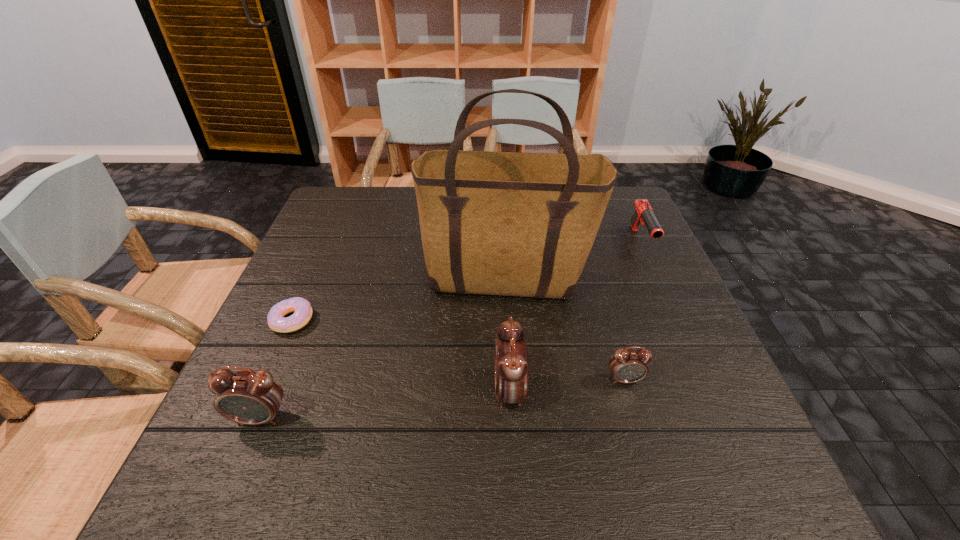
You are a GUI agent. You are given a task and a screenshot of the screen. Output one action in this format:
    pyautogui.click(x=<x>, y=<y>)
    Task: Click on the alarm clock that is the closest to the tallest object
    This screenshot has width=960, height=540.
    Given the screenshot: What is the action you would take?
    pyautogui.click(x=511, y=356)

The width and height of the screenshot is (960, 540). Find the location of `free space that satisfies the following two spatial constraints: 1. on the face of the shortest alarm clock; 2. on the face of the second alarm clock from right to left`. free space that satisfies the following two spatial constraints: 1. on the face of the shortest alarm clock; 2. on the face of the second alarm clock from right to left is located at coordinates [628, 392].

Identify the location of blank space that satisfies the following two spatial constraints: 1. at the aiming end of the rightmost object; 2. on the face of the second alarm clock from right to left. This screenshot has height=540, width=960. (708, 392).